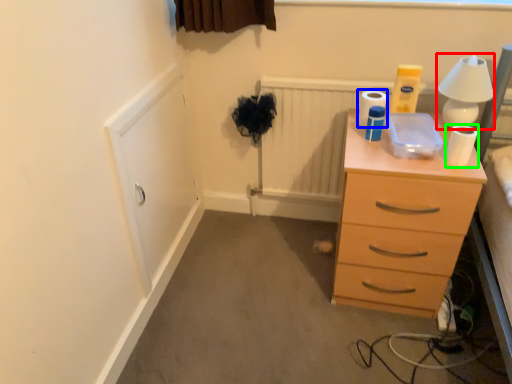
Question: Which object is positioned closest to table lamp (highlighted by a red box)? Select from toilet paper (highlighted by a blue box) and toilet paper (highlighted by a green box).

Choices:
 (A) toilet paper
 (B) toilet paper

Answer: (B)